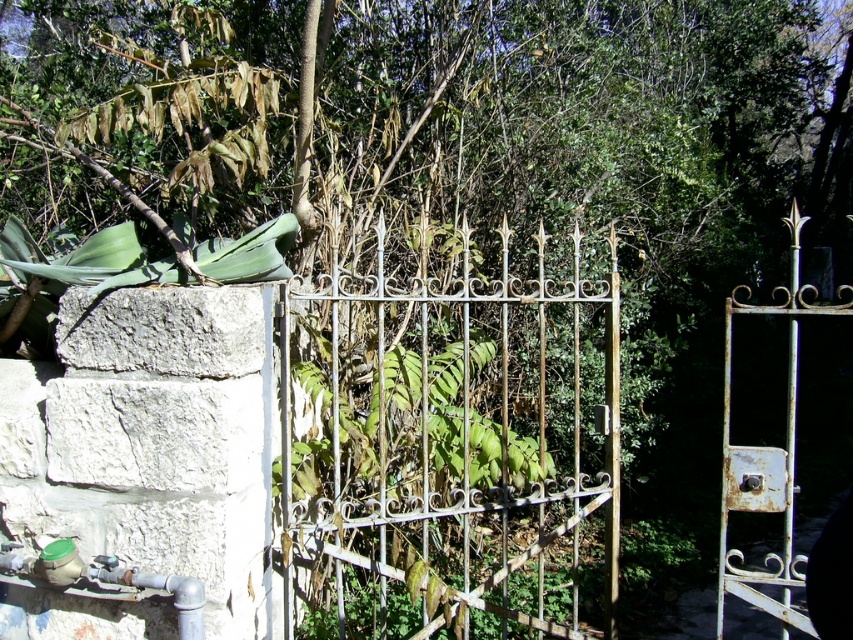
You are standing in the garden and want to walk towards the gate. There are two points marked in the image. Which point, point (548,634) or point (717,602), is closer to you as you face the gate?

Point (548,634) is closer to you because it is in front of point (717,602) when facing the gate.

You are a gardener who needs to pass through the gates in the garden. You have a wheelbarrow that is 1.5 meters wide. Which of the gates, the rusty metal gate at center or the rusty metal gate at right, will allow your wheelbarrow to pass through?

The rusty metal gate at center has a larger size compared to the rusty metal gate at right. Since your wheelbarrow is 1.5 meters wide, it will fit through the rusty metal gate at center but may not fit through the smaller rusty metal gate at right.